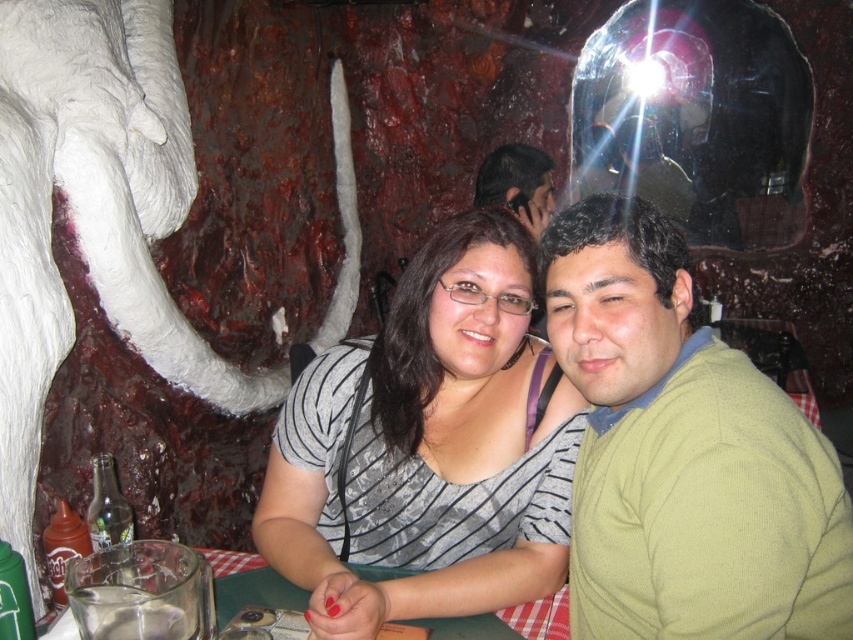
You are a photographer setting up for a group photo in the themed restaurant. The gray striped shirt at center is part of the group. To ensure everyone is in frame, where should you position the camera relative to the shirt?

The gray striped shirt at center is located at point (427, 449), so position the camera to capture the center area slightly to the right and middle of the scene to include all group members.

You are a delivery person standing at the entrance of the themed restaurant. You need to place a small package at a specific location marked by point (640, 385). The package must be placed within 40 inches from the entrance. Can you safely place the package at that point?

The distance of point (640, 385) from camera is 38.52 inches, which is within the 40 inches requirement. Therefore, you can safely place the package at that point.

You are a photographer setting up a shoot in this themed restaurant. You need to ensure that the two subjects wearing the gray striped shirt at center and the matte green sweater at center are framed properly. Which subject should you focus on first if you want to emphasize the larger garment in your composition?

The gray striped shirt at center should be focused on first because its width is larger than the matte green sweater at center, making it the more prominent garment in the scene.